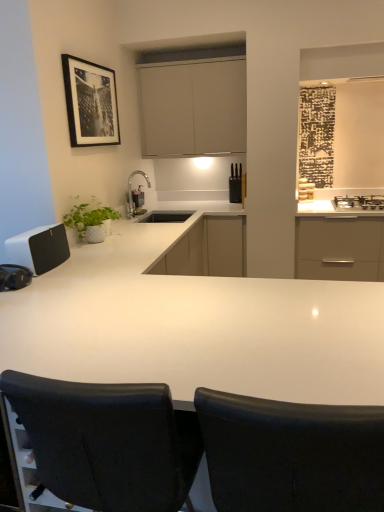
Question: In terms of width, does black glass gas stove at upper right look wider or thinner when compared to white matte cabinet at center, the 1th cabinetry ordered from the bottom?

Choices:
 (A) thin
 (B) wide

Answer: (A)

Question: Is black glass gas stove at upper right in front of or behind white matte cabinet at center, the 2th cabinetry in the top-to-bottom sequence, in the image?

Choices:
 (A) front
 (B) behind

Answer: (A)

Question: Which object is the farthest from the white matte speaker at left, acting as the 1th appliance starting from the front?

Choices:
 (A) black glass gas stove at upper right
 (B) matte white cabinet at upper center, the first cabinetry from the top
 (C) black framed print at upper left
 (D) white glossy countertop at center
 (E) satin nickel faucet at center

Answer: (A)

Question: Which object is the farthest from the black leather chair at center, which ranks as the first chair in right-to-left order?

Choices:
 (A) matte white cabinet at upper center, which appears as the 2th cabinetry when ordered from the bottom
 (B) white matte speaker at left, which appears as the first appliance when viewed from the left
 (C) white matte cabinet at center, the 2th cabinetry in the top-to-bottom sequence
 (D) black framed print at upper left
 (E) satin nickel faucet at center

Answer: (A)